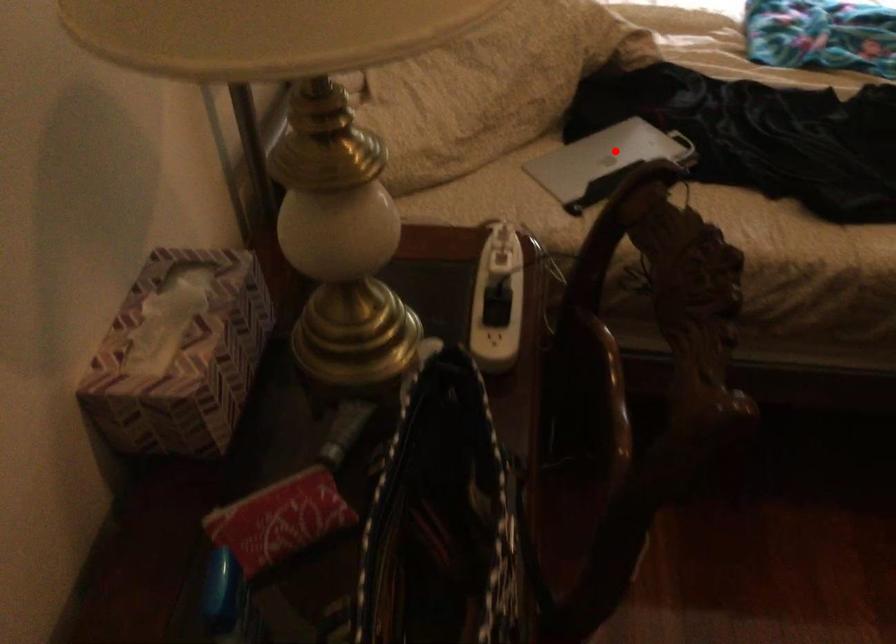
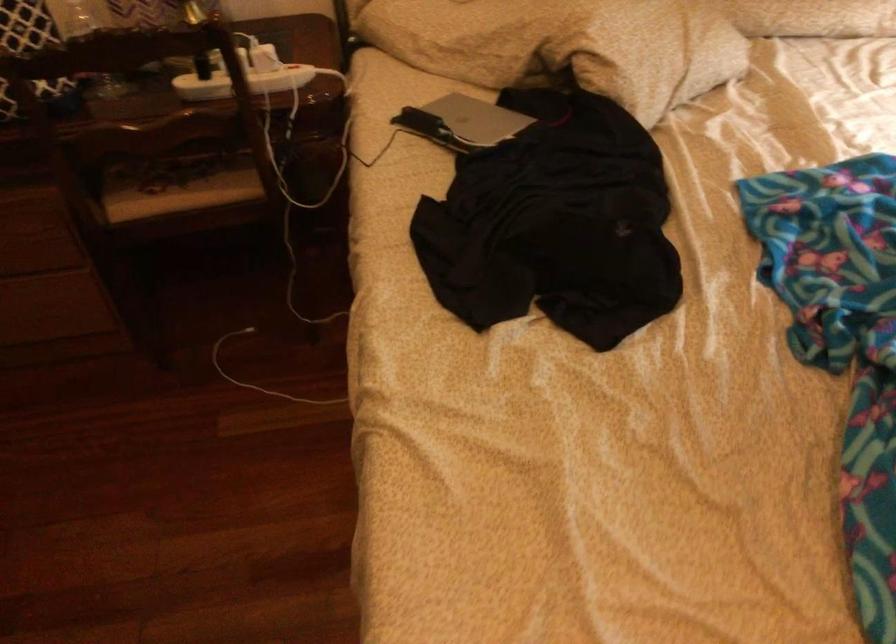
Question: I am providing you with two images of the same scene from different viewpoints. A red point is shown in image1. For the corresponding object point in image2, is it positioned nearer or farther from the camera?

Choices:
 (A) Nearer
 (B) Farther

Answer: (B)